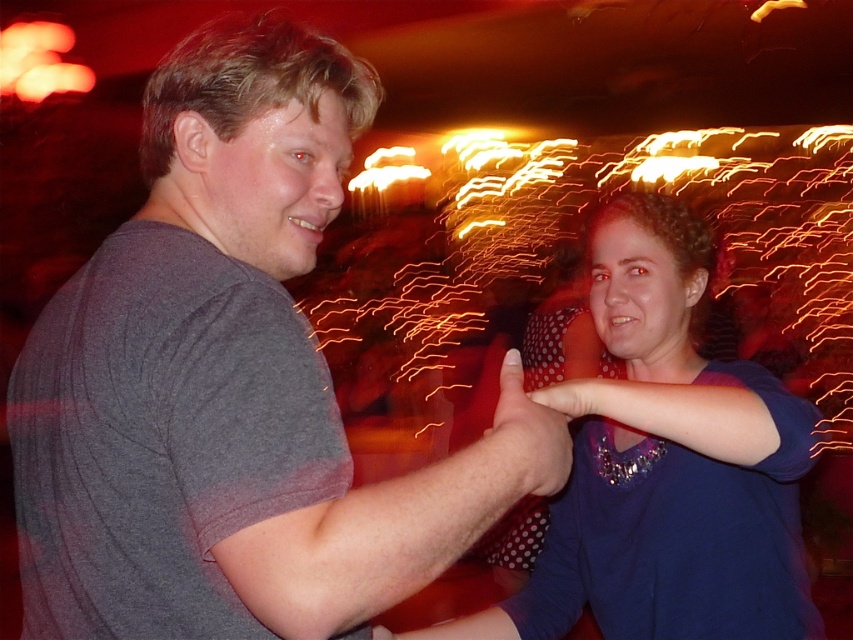
Question: Based on their relative distances, which object is farther from the blue dotted shirt at center?

Choices:
 (A) gray cotton t-shirt at left
 (B) polka dot fabric hand at center

Answer: (A)

Question: Does blue dotted shirt at center have a smaller size compared to polka dot fabric hand at center?

Choices:
 (A) yes
 (B) no

Answer: (B)

Question: Among these objects, which one is farthest from the camera?

Choices:
 (A) polka dot fabric hand at center
 (B) blue dotted shirt at center
 (C) gray cotton t-shirt at left

Answer: (B)

Question: Which of the following is the farthest from the observer?

Choices:
 (A) (311, 492)
 (B) (526, 400)
 (C) (693, 422)

Answer: (C)

Question: Does blue dotted shirt at center appear under polka dot fabric hand at center?

Choices:
 (A) no
 (B) yes

Answer: (B)

Question: Is gray cotton t-shirt at left behind polka dot fabric hand at center?

Choices:
 (A) yes
 (B) no

Answer: (B)